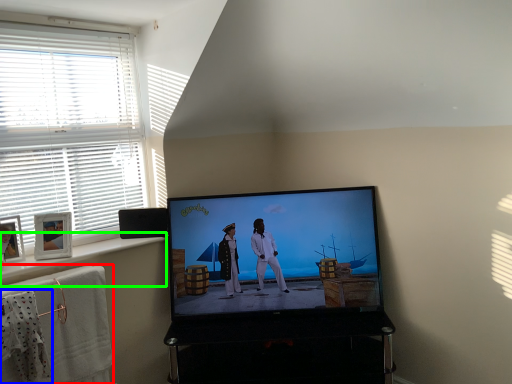
Question: Which object is the closest to the bath towel (highlighted by a red box)? Choose among these: laundry (highlighted by a blue box) or window sill (highlighted by a green box).

Choices:
 (A) laundry
 (B) window sill

Answer: (A)